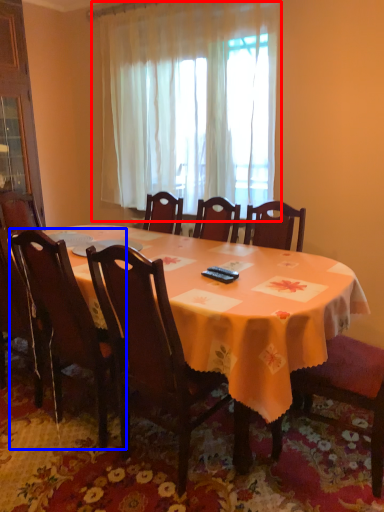
Question: Which point is further to the camera, curtain (highlighted by a red box) or chair (highlighted by a blue box)?

Choices:
 (A) curtain
 (B) chair

Answer: (A)